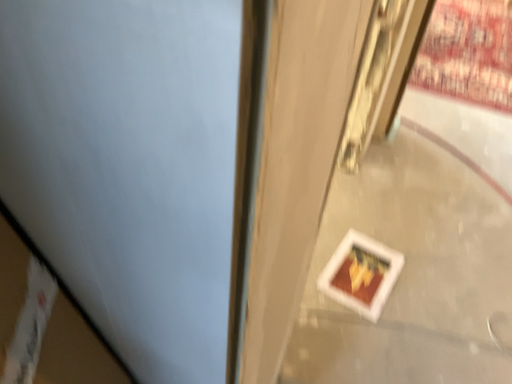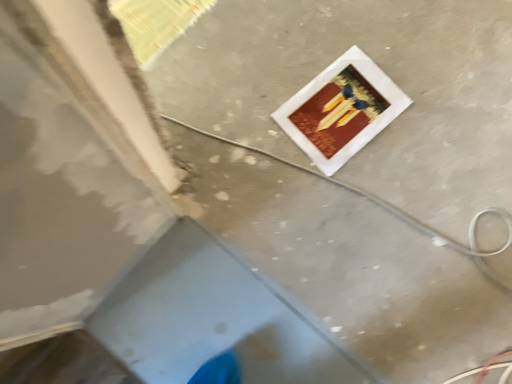
Question: How did the camera likely rotate when shooting the video?

Choices:
 (A) rotated upward
 (B) rotated downward

Answer: (B)